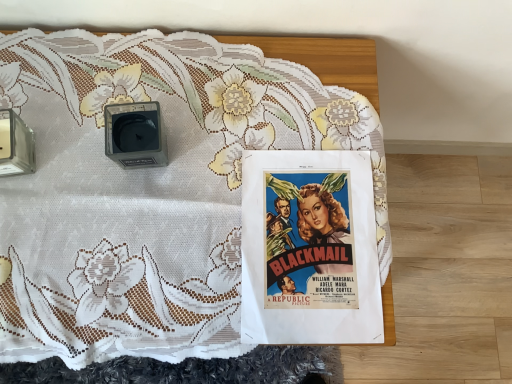
Identify the location of free space above vivid paper poster at center (from a real-world perspective). The image size is (512, 384). (309, 240).